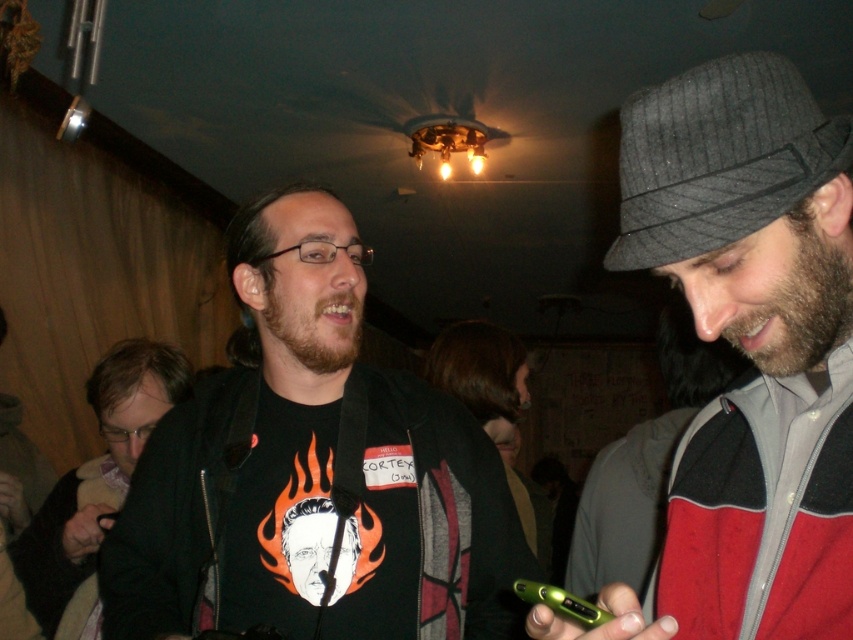
You are at a party and want to place a thin accessory on a table between the gray wool hat at right and the matte black jacket at left. Which object should you place it closer to?

The gray wool hat at right is thinner than the matte black jacket at left, so you should place the thin accessory closer to the gray wool hat at right to maintain proportion.